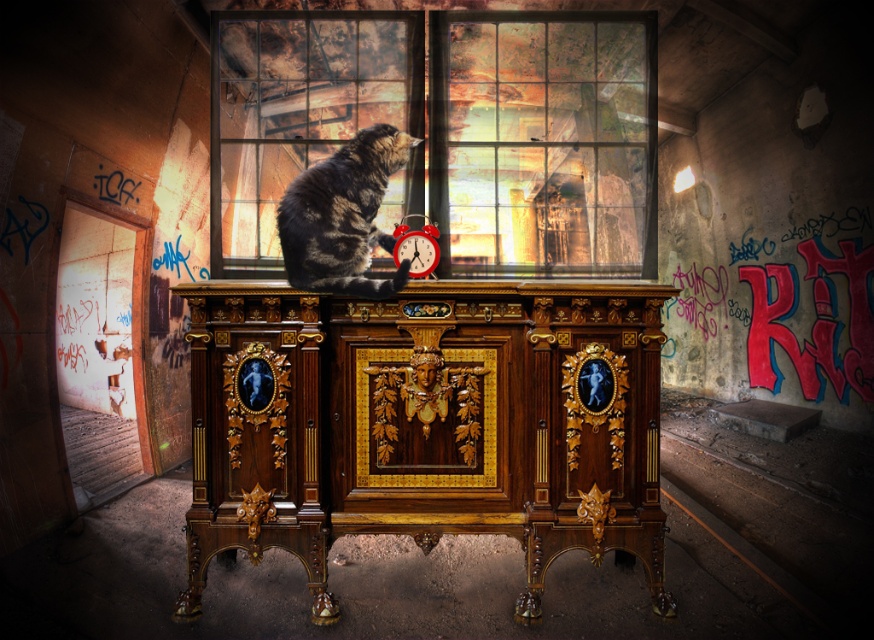
Does polished wood dresser at center appear on the right side of tabby fur cat at center?

Yes, polished wood dresser at center is to the right of tabby fur cat at center.

Locate an element on the screen. polished wood dresser at center is located at coordinates (425, 422).

Between polished wood dresser at center and glass pane at center, which one has more height?

Standing taller between the two is polished wood dresser at center.

Can you confirm if polished wood dresser at center is thinner than glass pane at center?

No, polished wood dresser at center is not thinner than glass pane at center.

Is point (212, 360) closer to viewer compared to point (303, 113)?

That is True.

Where is `polished wood dresser at center`? The image size is (874, 640). polished wood dresser at center is located at coordinates (425, 422).

Does point (359, 168) come farther from viewer compared to point (411, 257)?

No, it is not.

Consider the image. Between tabby fur cat at center and red alarm clock at center, which one is positioned lower?

tabby fur cat at center is below.

Identify the location of tabby fur cat at center. Image resolution: width=874 pixels, height=640 pixels. (343, 216).